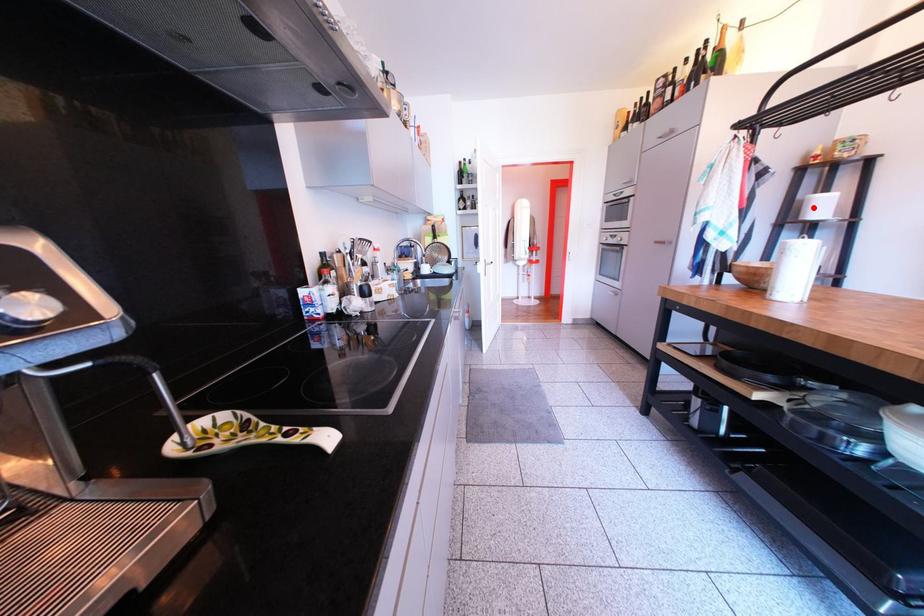
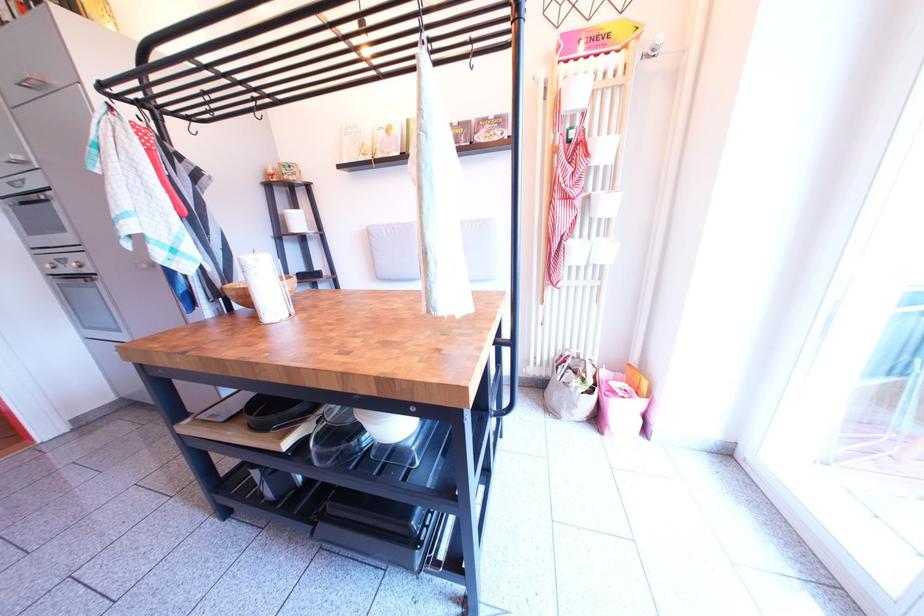
Question: I am providing you with two images of the same scene from different viewpoints. Image1 has a red point marked. In image2, the corresponding 3D location appears at what relative position? Reply with the corresponding letter.

Choices:
 (A) Closer
 (B) Farther

Answer: (A)